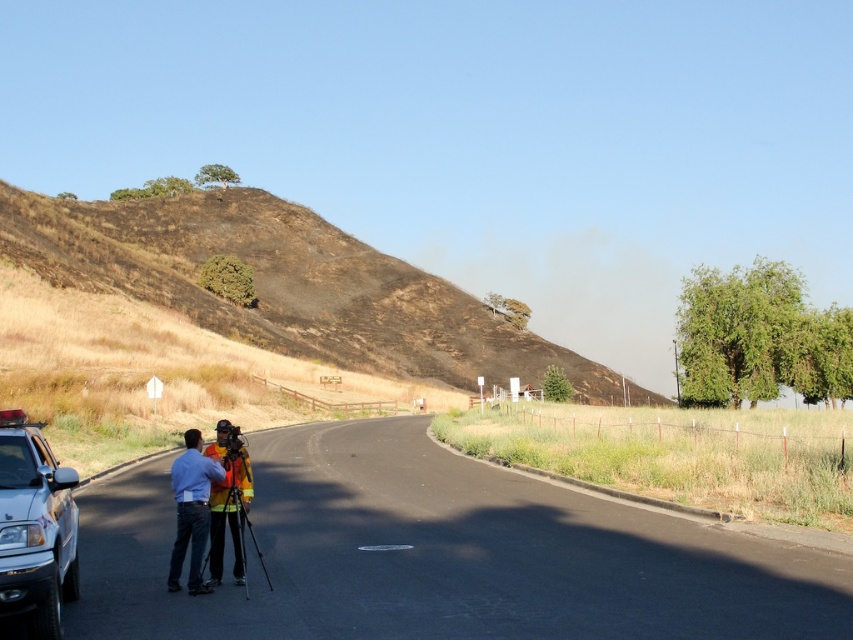
Question: Which of the following is the farthest from the observer?

Choices:
 (A) (606, 388)
 (B) (503, 586)
 (C) (39, 468)
 (D) (192, 579)

Answer: (A)

Question: Is black asphalt road at center closer to camera compared to burnt grass at upper left?

Choices:
 (A) no
 (B) yes

Answer: (B)

Question: Estimate the real-world distances between objects in this image. Which object is closer to the burnt grass at upper left?

Choices:
 (A) black asphalt road at center
 (B) reflective yellow safety vest at center
 (C) silver metallic truck at lower left

Answer: (A)

Question: Which point is farther to the camera?

Choices:
 (A) silver metallic truck at lower left
 (B) reflective yellow safety vest at center
 (C) black asphalt road at center

Answer: (B)

Question: Does black asphalt road at center appear over burnt grass at upper left?

Choices:
 (A) yes
 (B) no

Answer: (B)

Question: Does black asphalt road at center lie behind burnt grass at upper left?

Choices:
 (A) no
 (B) yes

Answer: (A)